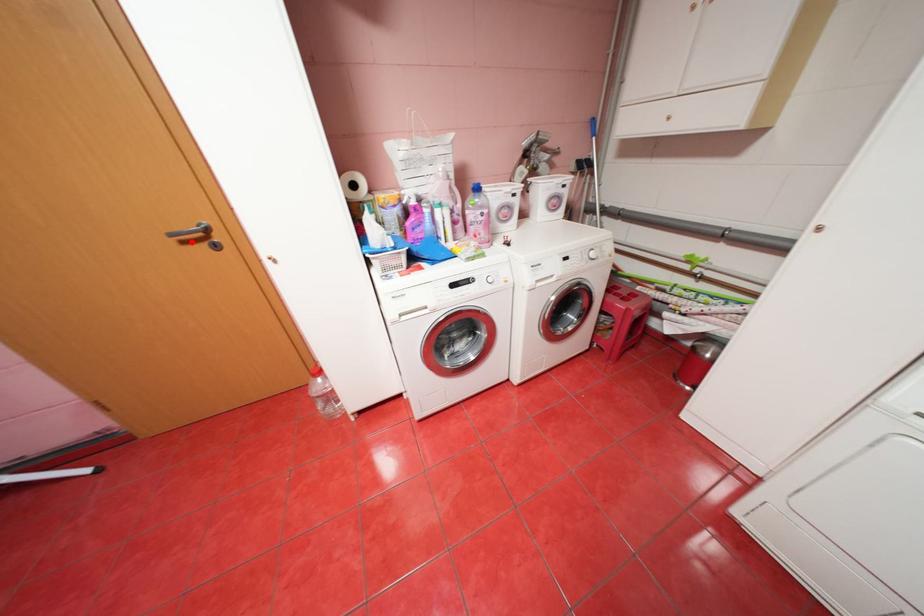
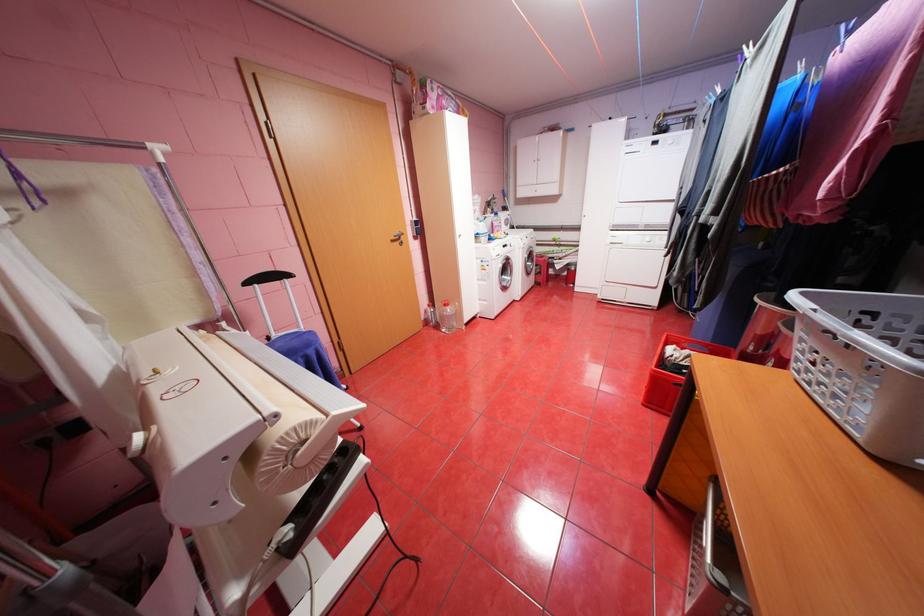
Where in the second image is the point corresponding to the highlighted location from the first image?

(400, 241)